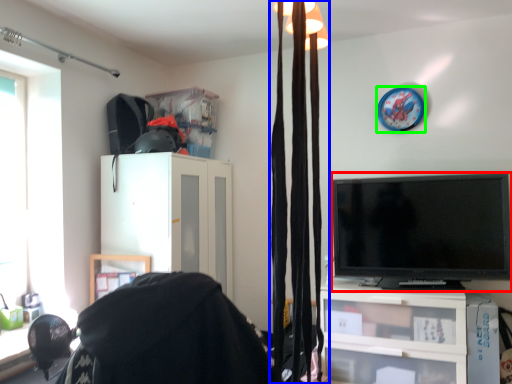
Question: Which object is the closest to the television (highlighted by a red box)? Choose among these: curtain (highlighted by a blue box) or clock (highlighted by a green box).

Choices:
 (A) curtain
 (B) clock

Answer: (B)